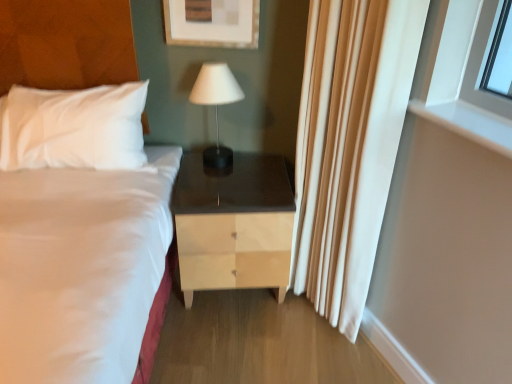
The image size is (512, 384). What are the coordinates of `unoccupied region to the right of white matte table lamp at center` in the screenshot? It's located at (258, 162).